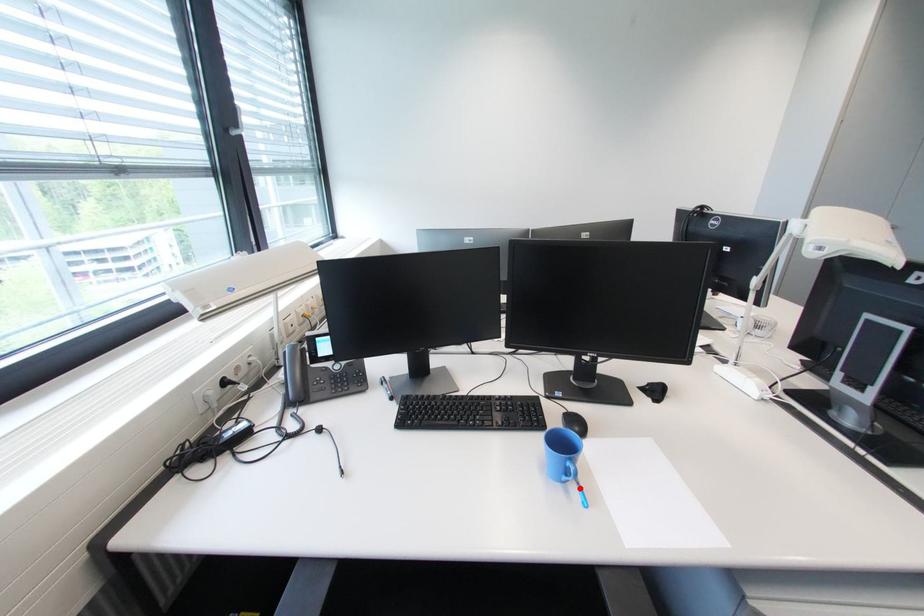
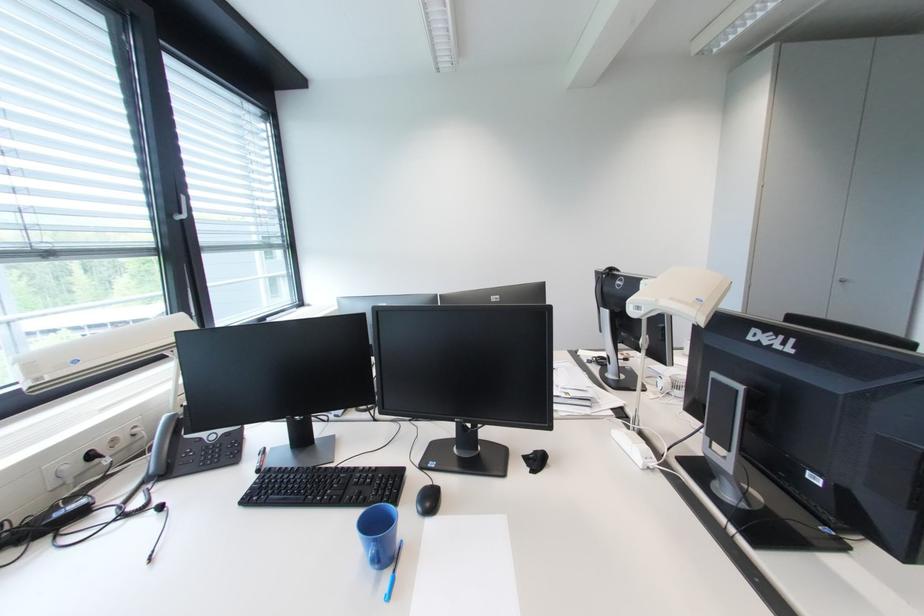
Locate, in the second image, the point that corresponds to the highlighted location in the first image.

(394, 577)